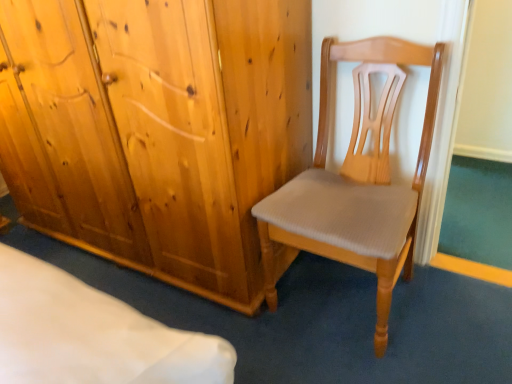
Find the location of `vacant area in front of light brown wood chair at center`. vacant area in front of light brown wood chair at center is located at coordinates (379, 361).